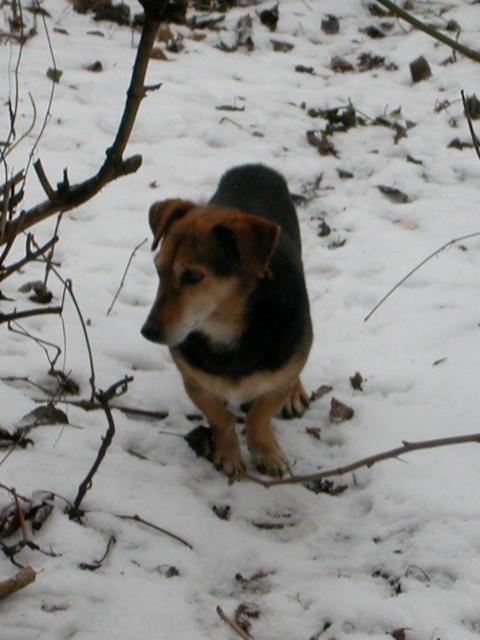
You are a photographer trying to capture the brown fur dog at center and the brown woody branch at lower center in the same frame. Based on their sizes, which object would you need to position closer to the camera to make them appear similar in size in the photo?

The brown woody branch at lower center needs to be positioned closer to the camera because it is smaller in size compared to the brown fur dog at center. By moving it closer, its apparent size in the photo will increase to match the dog.

You are a photographer setting up a tripod in the snow. You need to position it so that it doesn not block the view of the brown fur dog at center and the brown woody branch at lower center. Given that the tripod is 1.2 meters tall, will its height interfere with capturing both objects in the frame?

The brown fur dog at center is taller than the brown woody branch at lower center. Since the tripod is 1.2 meters tall, if the dog is taller than 1.2 meters, the tripod might block its view. However, without specific height measurements for the dog, we can only compare relative sizes. The answer depends on the actual height of the dog compared to the tripod.

You are a photographer trying to capture the brown fur dog at center and the brown woody branch at lower center in a single shot. Based on their positions, which object is closer to the camera?

The brown fur dog at center is above the brown woody branch at lower center, so the dog is closer to the camera.